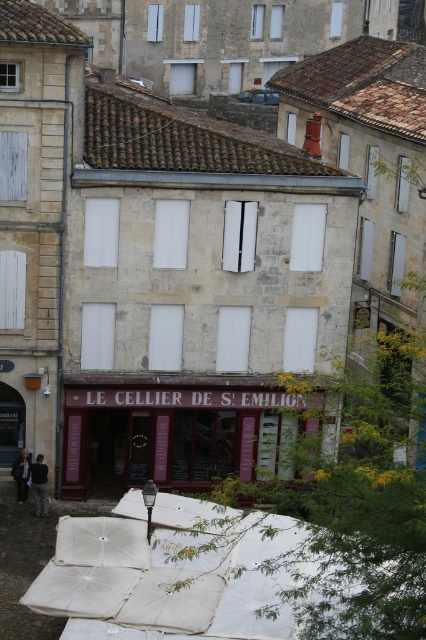
Can you confirm if beige fabric umbrella at lower center is positioned to the left of dark gray jacket at lower left?

In fact, beige fabric umbrella at lower center is to the right of dark gray jacket at lower left.

Which is more to the right, beige fabric umbrella at lower center or dark gray jacket at lower left?

beige fabric umbrella at lower center is more to the right.

The image size is (426, 640). In order to click on beige fabric umbrella at lower center in this screenshot , I will do `click(218, 576)`.

Locate an element on the screen. This screenshot has height=640, width=426. beige fabric umbrella at lower center is located at coordinates (218, 576).

Is beige fabric umbrella at lower center positioned behind black leather jacket at lower left?

No.

Does beige fabric umbrella at lower center have a greater height compared to black leather jacket at lower left?

Correct, beige fabric umbrella at lower center is much taller as black leather jacket at lower left.

Locate an element on the screen. beige fabric umbrella at lower center is located at coordinates (218, 576).

Is black leather jacket at lower left above dark gray jacket at lower left?

Actually, black leather jacket at lower left is below dark gray jacket at lower left.

Does point (32, 468) lie in front of point (11, 465)?

Yes, point (32, 468) is in front of point (11, 465).

Find the location of a particular element. The image size is (426, 640). black leather jacket at lower left is located at coordinates (39, 484).